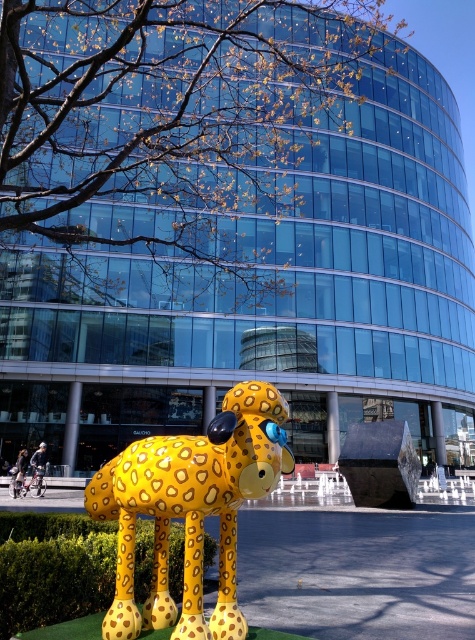
You are standing at the center of the image and want to find the yellow spotted dog at center. In which direction should you look to locate it?

The yellow spotted dog at center is located at the center of the image, so you should look straight ahead to locate it.

You are a photographer planning to take a picture of the yellow spotted dog at center and the green hedge at lower left. If you want to ensure both are in focus, which object should you focus on first, the one closer to you or the one further away?

The yellow spotted dog at center is positioned over green hedge at lower left, meaning it is closer to you. To ensure both are in focus, you should focus on the yellow spotted dog at center first since it is the closer object.

You are a photographer planning to capture the yellow spotted dog at center and the green hedge at lower left in the same frame. Based on their heights, which object should you focus on first to ensure both are in the shot?

The yellow spotted dog at center is taller than the green hedge at lower left, so you should focus on the yellow spotted dog at center first to ensure both are in the shot.